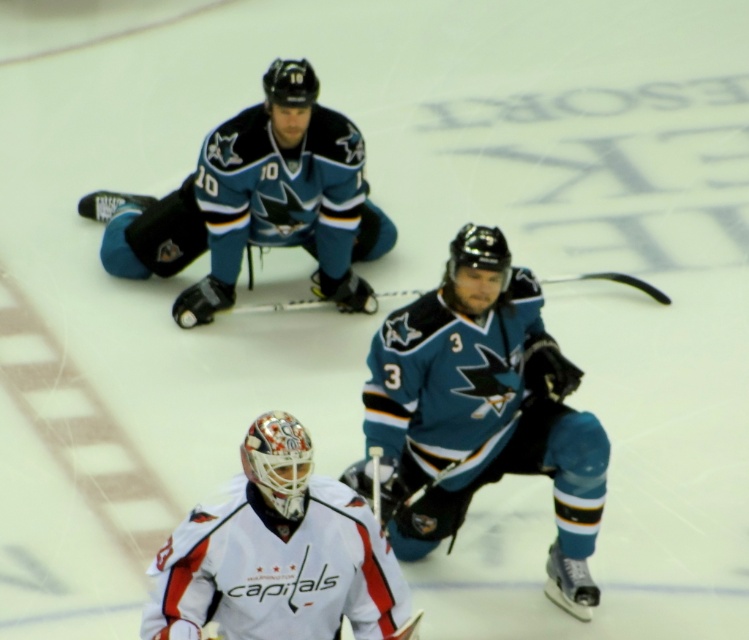
You are an equipment inspector checking the ice hockey gear. You need to ensure that the white matte goalie mask at center does not extend beyond the width of the black matte hockey stick at center. Based on the image, is there a risk that the mask is too wide?

The white matte goalie mask at center might be wider than black matte hockey stick at center, so there is a risk that the mask exceeds the required width and may not meet safety standards.